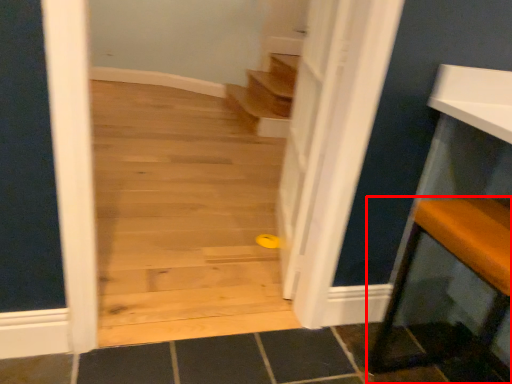
Question: Observing the image, what is the correct spatial positioning of furniture (annotated by the red box) in reference to door?

Choices:
 (A) right
 (B) left

Answer: (A)